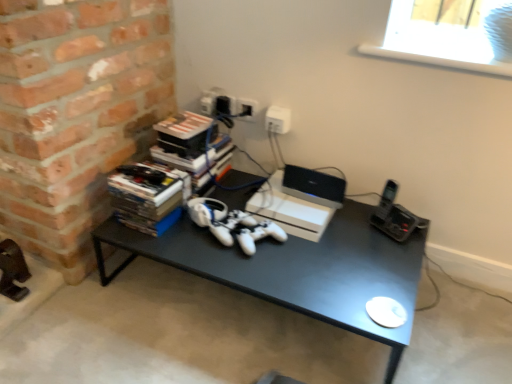
Locate an element on the screen. The image size is (512, 384). free location in front of white matte gaming console at center is located at coordinates (308, 261).